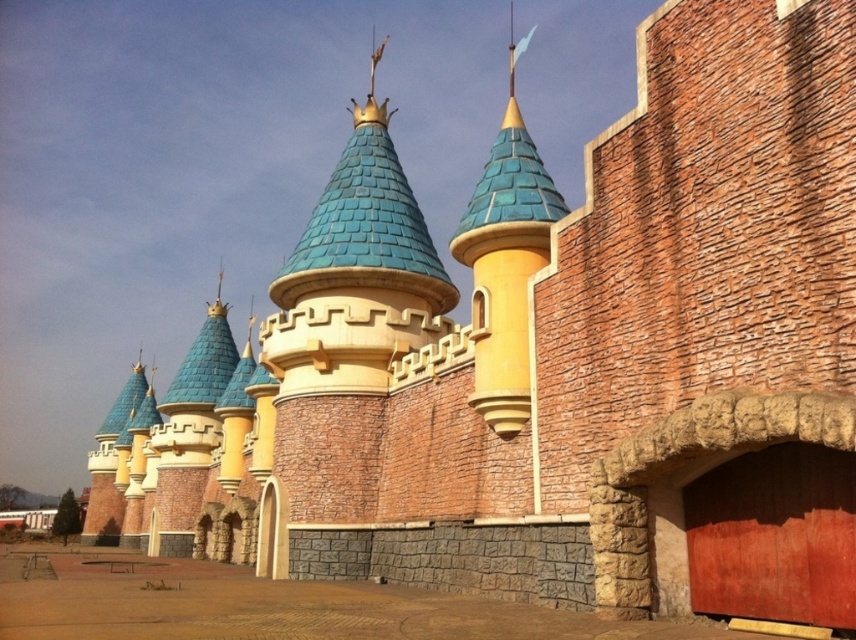
Question: Which object is closer to the camera taking this photo?

Choices:
 (A) red matte garage door at lower right
 (B) matte blue tile tower at center

Answer: (A)

Question: Which point is closer to the camera?

Choices:
 (A) (761, 566)
 (B) (486, 192)

Answer: (A)

Question: Can you confirm if red matte garage door at lower right is wider than matte blue tile tower at center?

Choices:
 (A) no
 (B) yes

Answer: (A)

Question: Is red matte garage door at lower right smaller than matte blue tile tower at center?

Choices:
 (A) no
 (B) yes

Answer: (B)

Question: Is red matte garage door at lower right to the right of matte blue tile tower at center from the viewer's perspective?

Choices:
 (A) yes
 (B) no

Answer: (B)